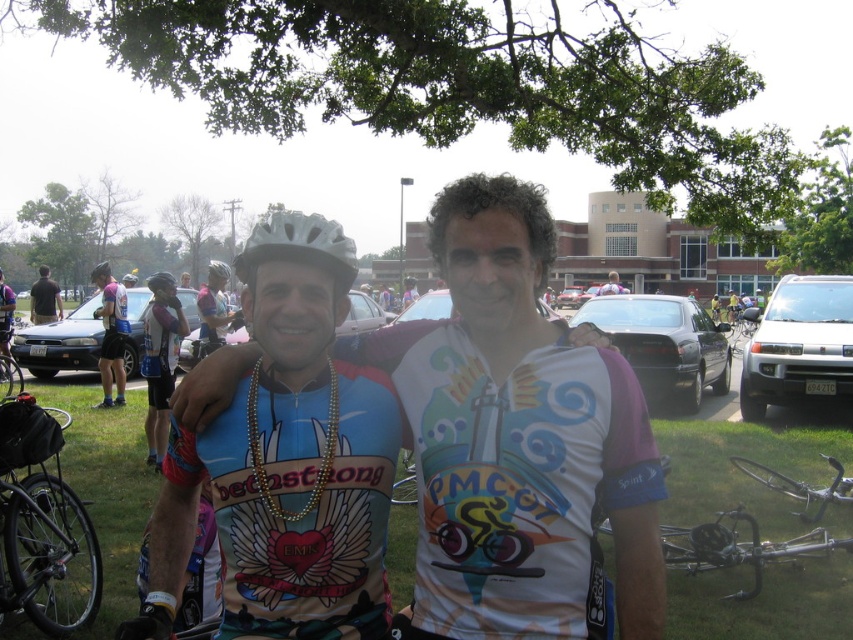
You are a photographer standing at the camera position. You want to hand your camera to the person wearing the white matte bicycle helmet at upper center. Can you do this without moving from your current position? Explain why or why not.

The white matte bicycle helmet at upper center and camera are 8.13 meters apart. Since the distance between them is over 8 meters, you cannot hand the camera to the person without moving from your current position as the distance is too far for direct handover.

You are a photographer at the cycling event. You need to place a small flag between the silver metallic helmet at center and the white matte bicycle helmet at center. Which helmet should the flag be placed above to ensure it is between them?

The silver metallic helmet at center is positioned under the white matte bicycle helmet at center, so placing the flag above the silver metallic helmet at center would place it between the two helmets.

Consider the image. You are a photographer at the event and need to choose a helmet to place on a mannequin head that requires a helmet with a larger size. Which helmet should you select between the silver metallic helmet at center and the white matte bicycle helmet at center?

The white matte bicycle helmet at center is larger in size than the silver metallic helmet at center, so you should choose the white matte bicycle helmet at center for the mannequin head.